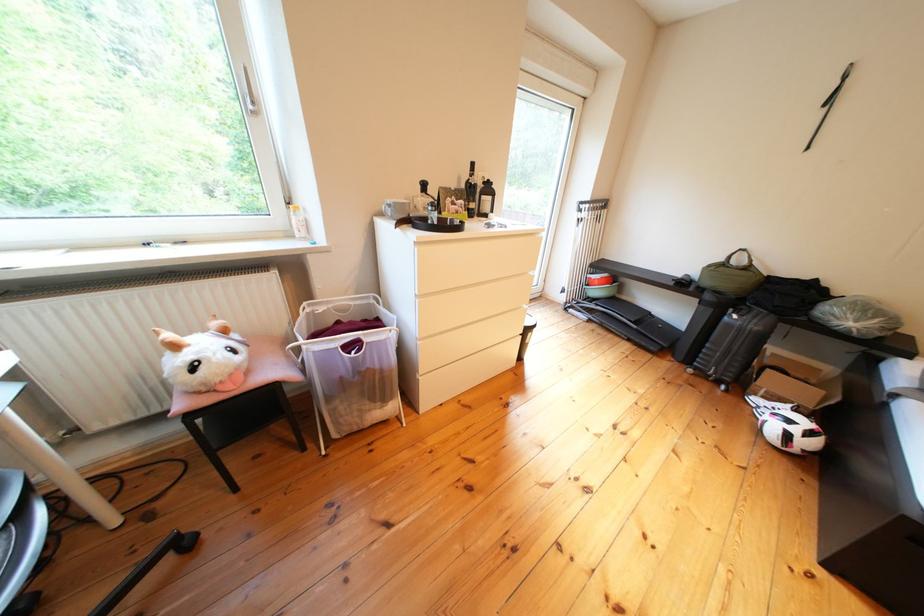
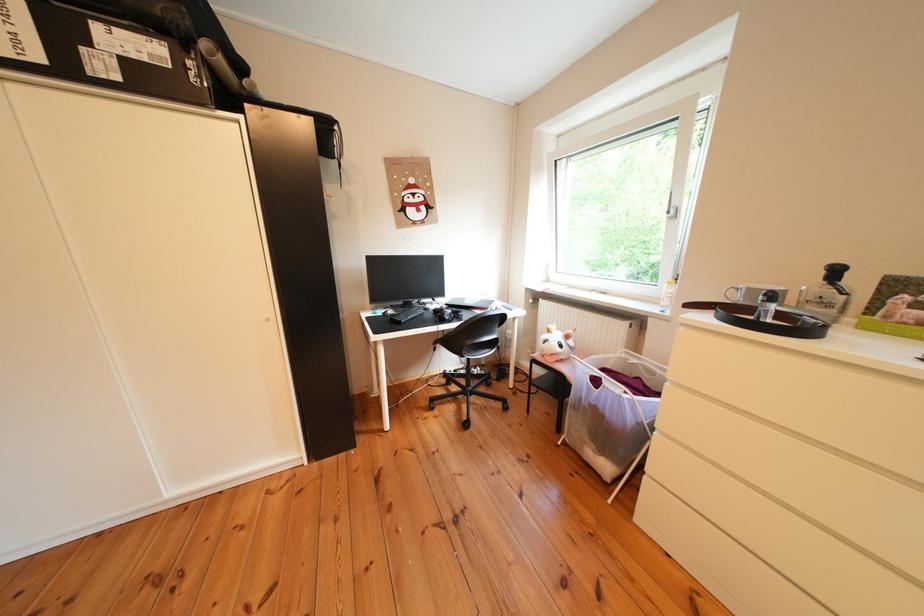
Question: The first image is from the beginning of the video and the second image is from the end. How did the camera likely rotate when shooting the video?

Choices:
 (A) Left
 (B) Right
 (C) Up
 (D) Down

Answer: (A)